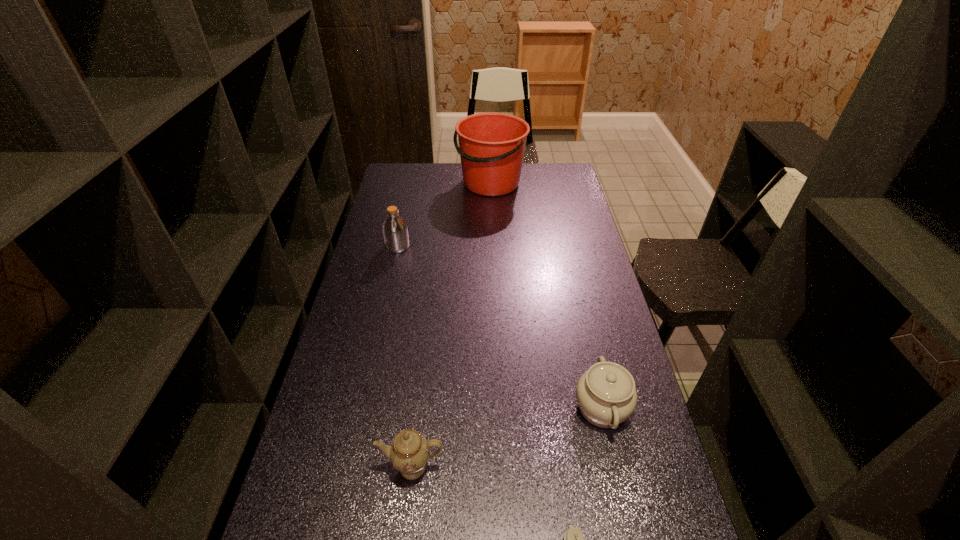
The width and height of the screenshot is (960, 540). What are the coordinates of `vacant area situated on the spout of the fourth farthest object` in the screenshot? It's located at (405, 532).

What are the coordinates of `free space located on the front of the rightmost object` in the screenshot? It's located at (628, 519).

Where is `object that is at the far edge`? Image resolution: width=960 pixels, height=540 pixels. object that is at the far edge is located at coordinates (491, 145).

Identify the location of object at the left edge. This screenshot has height=540, width=960. (395, 231).

Locate an element on the screen. The height and width of the screenshot is (540, 960). object that is at the right edge is located at coordinates (606, 395).

In the image, there is a desktop. Identify the location of vacant space at the left edge. (377, 336).

The width and height of the screenshot is (960, 540). Identify the location of vacant space at the right edge of the desktop. (590, 286).

The image size is (960, 540). What are the coordinates of `unoccupied area between the leftmost object and the bucket` in the screenshot? It's located at (444, 215).

Identify the location of unoccupied area between the rightmost object and the leftmost object. The height and width of the screenshot is (540, 960). (500, 327).

At what (x,y) coordinates should I click in order to perform the action: click on free space between the left chinaware and the fourth nearest object. Please return your answer as a coordinate pair (x, y). This screenshot has height=540, width=960. Looking at the image, I should click on (405, 357).